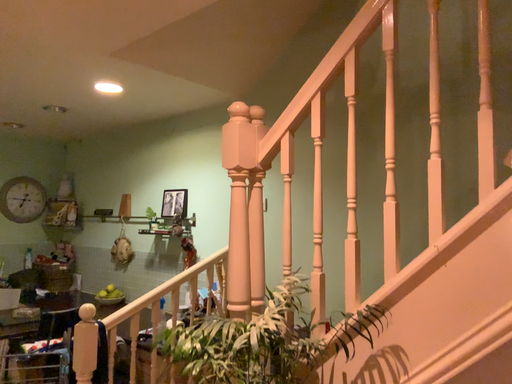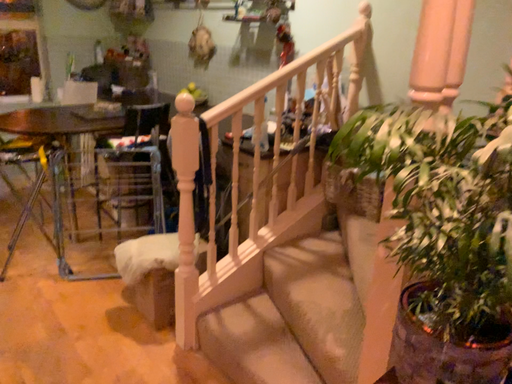
Question: Which way did the camera rotate in the video?

Choices:
 (A) rotated upward
 (B) rotated downward

Answer: (B)